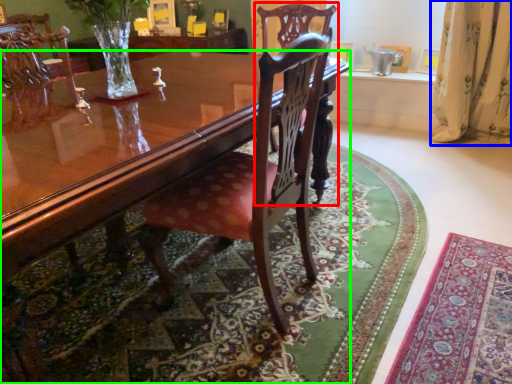
Question: Which object is positioned farthest from chair (highlighted by a red box)? Select from curtain (highlighted by a blue box) and coffee table (highlighted by a green box).

Choices:
 (A) curtain
 (B) coffee table

Answer: (A)